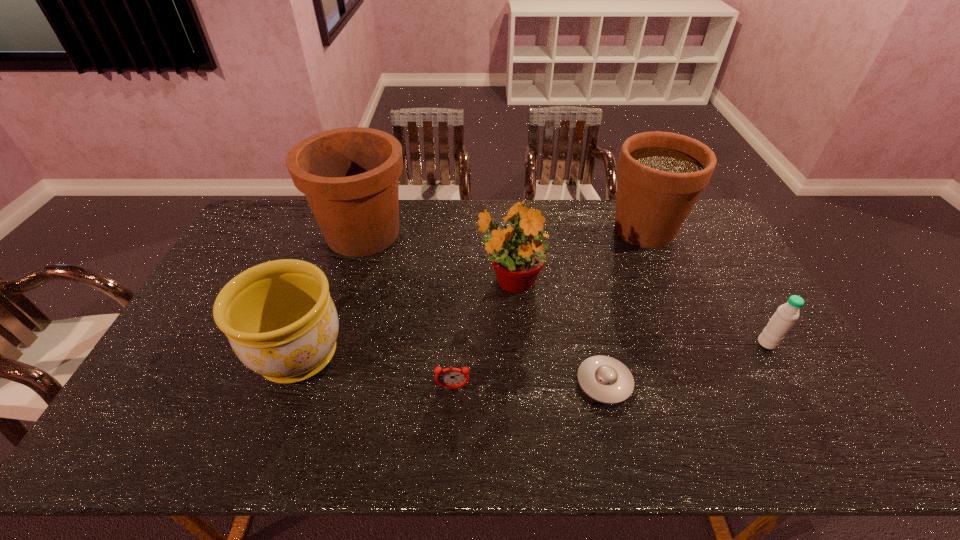
Identify the location of the second object from right to left. This screenshot has height=540, width=960. (661, 175).

The width and height of the screenshot is (960, 540). In order to click on the fourth object from left to right in this screenshot , I will do `click(517, 252)`.

Locate an element on the screen. This screenshot has width=960, height=540. the nearest flowerpot is located at coordinates (281, 322).

Where is `the fourth shortest object`? The height and width of the screenshot is (540, 960). the fourth shortest object is located at coordinates (281, 322).

At what (x,y) coordinates should I click in order to perform the action: click on the third shortest object. Please return your answer as a coordinate pair (x, y). Looking at the image, I should click on (783, 319).

Identify the location of the rightmost object. (783, 319).

Locate an element on the screen. This screenshot has width=960, height=540. the sixth tallest object is located at coordinates (452, 378).

Find the location of a particular element. This screenshot has width=960, height=540. the fifth object from right to left is located at coordinates (452, 378).

I want to click on saucer, so click(605, 379).

The image size is (960, 540). Find the location of `the third object from right to left`. the third object from right to left is located at coordinates (605, 379).